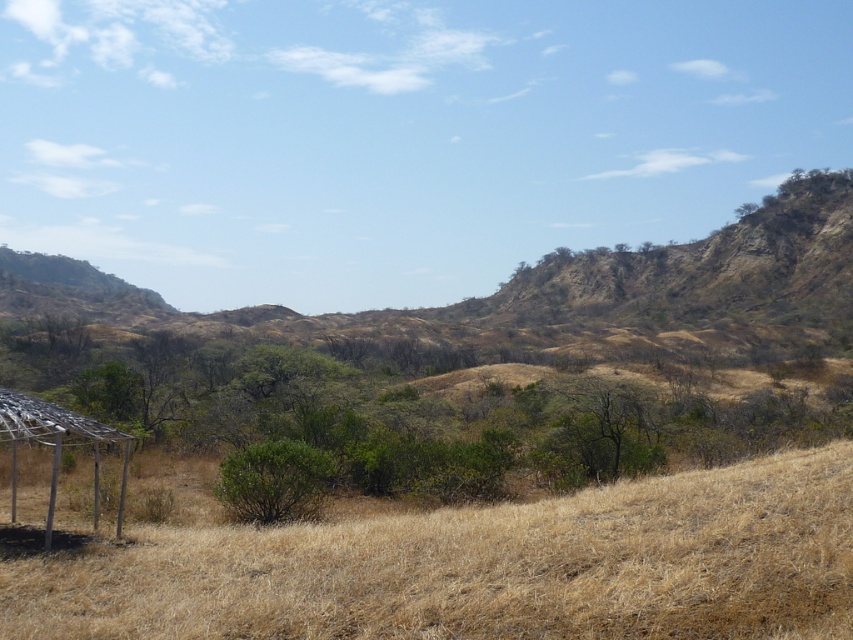
You are standing at the edge of the landscape and want to walk towards the metallic silver gazebo at lower left. As you move forward, will the dry grass at lower center be in your path?

The dry grass at lower center is positioned over the metallic silver gazebo at lower left, so the gazebo is underneath the grass. Therefore, the dry grass at lower center would block your path to the gazebo.

You are planning to set up a picnic in the open landscape. You have a picnic blanket that is 3 meters wide. You see the dry grass at lower center and the metallic silver gazebo at lower left. Which area would be suitable for placing your blanket without it overlapping the gazebo?

The dry grass at lower center has a greater width than the metallic silver gazebo at lower left, so placing the picnic blanket on the dry grass at lower center would provide enough space without overlapping the gazebo.

You are standing at the center of the image and want to find the dry grass at lower center. According to the coordinates provided, in which direction should you look to locate it?

The dry grass at lower center is located at coordinates point (485,566), which means it is positioned to the right and slightly below the center of the image. Since you are standing at the center, you should look towards the lower right direction to find it.